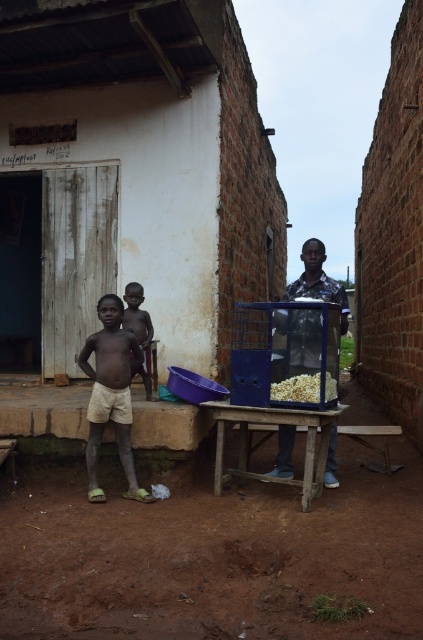
Question: Is metallic popcorn machine at center to the right of white popcorn at center from the viewer's perspective?

Choices:
 (A) no
 (B) yes

Answer: (B)

Question: Considering the relative positions of light beige shorts at center and metallic popcorn machine at center in the image provided, where is light beige shorts at center located with respect to metallic popcorn machine at center?

Choices:
 (A) right
 (B) left

Answer: (B)

Question: Based on their relative distances, which object is nearer to the light beige shorts at center?

Choices:
 (A) white popcorn at center
 (B) metallic popcorn machine at center
 (C) dark skin child at center

Answer: (C)

Question: Considering the real-world distances, which object is farthest from the dark skin child at center?

Choices:
 (A) metallic popcorn machine at center
 (B) white popcorn at center

Answer: (B)

Question: Which of the following is the closest to the observer?

Choices:
 (A) (145, 381)
 (B) (321, 272)

Answer: (B)

Question: Can you confirm if dark skin child at center is wider than white popcorn at center?

Choices:
 (A) no
 (B) yes

Answer: (A)